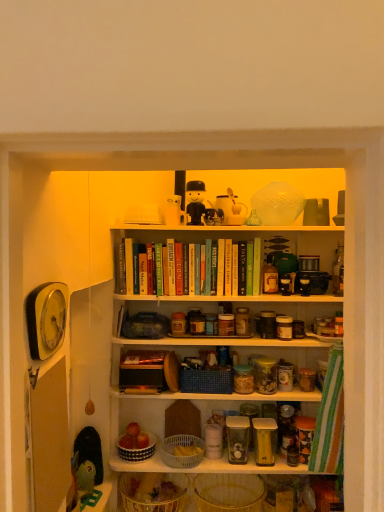
Question: From a real-world perspective, is translucent wicker basket at lower center, which ranks as the 1th basket in bottom-to-top order, positioned over white plastic basket at center, the third basket when ordered from bottom to top, based on gravity?

Choices:
 (A) yes
 (B) no

Answer: (B)

Question: From the image's perspective, is translucent wicker basket at lower center, marked as the 5th basket in a top-to-bottom arrangement, located beneath white plastic basket at center, the third basket when ordered from bottom to top?

Choices:
 (A) no
 (B) yes

Answer: (B)

Question: Can you confirm if translucent wicker basket at lower center, marked as the 5th basket in a top-to-bottom arrangement, is bigger than white plastic basket at center, the third basket positioned from the top?

Choices:
 (A) no
 (B) yes

Answer: (B)

Question: Considering the relative sizes of translucent wicker basket at lower center, marked as the 5th basket in a top-to-bottom arrangement, and white plastic basket at center, the third basket when ordered from bottom to top, in the image provided, is translucent wicker basket at lower center, marked as the 5th basket in a top-to-bottom arrangement, taller than white plastic basket at center, the third basket when ordered from bottom to top,?

Choices:
 (A) yes
 (B) no

Answer: (A)

Question: Is translucent wicker basket at lower center, marked as the 5th basket in a top-to-bottom arrangement, facing away from white plastic basket at center, the third basket when ordered from bottom to top?

Choices:
 (A) no
 (B) yes

Answer: (A)

Question: Is translucent wicker basket at lower center, which ranks as the 1th basket in bottom-to-top order, aimed at white plastic basket at center, the third basket positioned from the top?

Choices:
 (A) yes
 (B) no

Answer: (B)

Question: Is clear glass jar at center surrounding green matte book at upper center?

Choices:
 (A) yes
 (B) no

Answer: (B)

Question: Is clear glass jar at center aimed at green matte book at upper center?

Choices:
 (A) no
 (B) yes

Answer: (A)

Question: From the image's perspective, is clear glass jar at center below green matte book at upper center?

Choices:
 (A) yes
 (B) no

Answer: (A)

Question: From the image's perspective, is clear glass jar at center above green matte book at upper center?

Choices:
 (A) no
 (B) yes

Answer: (A)

Question: Is clear glass jar at center further to the viewer compared to green matte book at upper center?

Choices:
 (A) no
 (B) yes

Answer: (A)

Question: Is clear glass jar at center in contact with green matte book at upper center?

Choices:
 (A) yes
 (B) no

Answer: (B)

Question: Is clear glass jar at center further to the viewer compared to translucent wicker basket at lower center, which ranks as the 1th basket in bottom-to-top order?

Choices:
 (A) no
 (B) yes

Answer: (B)